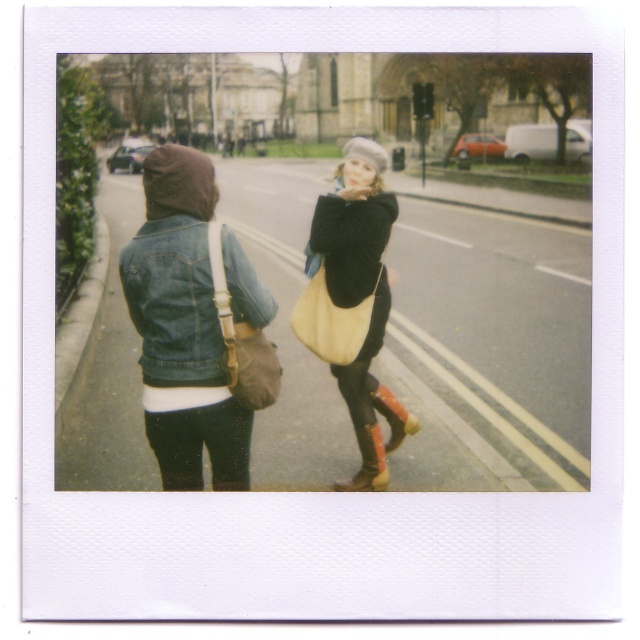
Is the position of matte yellow bag at center more distant than that of leather tan bag at center?

Yes.

Can you confirm if matte yellow bag at center is smaller than leather tan bag at center?

Indeed, matte yellow bag at center has a smaller size compared to leather tan bag at center.

Which is behind, point (372, 173) or point (368, 310)?

Positioned behind is point (372, 173).

Where is `matte yellow bag at center`? The width and height of the screenshot is (640, 640). matte yellow bag at center is located at coordinates (360, 296).

Can you confirm if brown leather bag at left is bigger than leather tan bag at center?

No.

Does brown leather bag at left appear on the left side of leather tan bag at center?

Yes, brown leather bag at left is to the left of leather tan bag at center.

Between point (236, 333) and point (310, 328), which one is positioned in front?

Point (236, 333)

Where is `brown leather bag at left`? The image size is (640, 640). brown leather bag at left is located at coordinates (241, 340).

Is point (163, 248) in front of point (371, 403)?

Yes.

Who is more distant from viewer, [262,292] or [388,420]?

Point [388,420]

I want to click on denim jacket at left, so click(x=182, y=326).